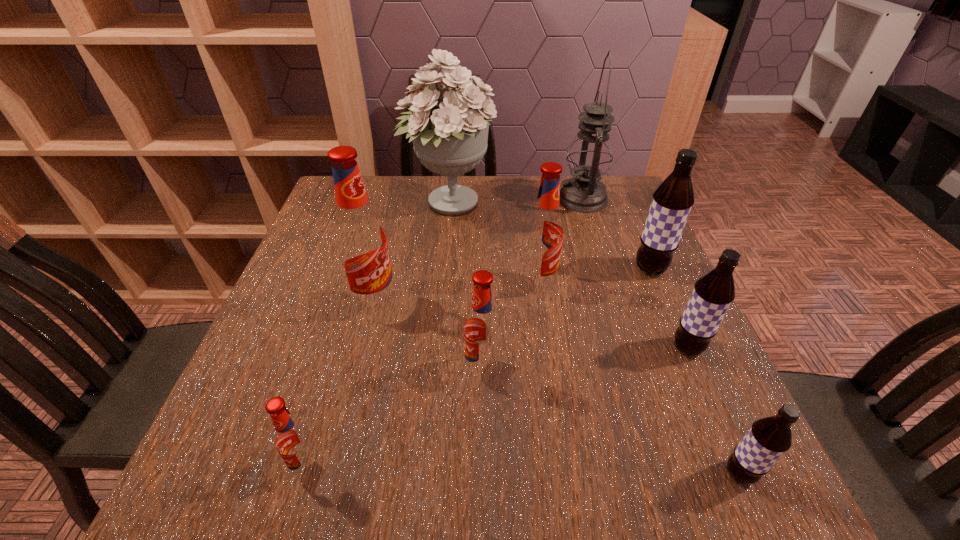
Identify the location of free space between the fourth root beer from right to left and the biggest brown root beer. (594, 276).

You are a GUI agent. You are given a task and a screenshot of the screen. Output one action in this format:
    pyautogui.click(x=<x>, y=<y>)
    Task: Click on the vacant region between the third farthest red root beer and the second farthest brown root beer
    
    Given the screenshot: What is the action you would take?
    pyautogui.click(x=585, y=359)

What are the coordinates of `vacant space that's between the third biggest red root beer and the biggest brown root beer` in the screenshot? It's located at (566, 319).

This screenshot has height=540, width=960. Find the location of `object that stands as the fourth closest to the oil lamp`. object that stands as the fourth closest to the oil lamp is located at coordinates (713, 293).

This screenshot has width=960, height=540. Find the location of `object that is the seventh closest to the fifth root beer from right to left`. object that is the seventh closest to the fifth root beer from right to left is located at coordinates (450, 139).

Find the location of a particular element. This screenshot has width=960, height=540. root beer that can be found as the closest to the rightmost red root beer is located at coordinates (482, 328).

In order to click on the closest root beer to the green bouquet in this screenshot , I will do `click(543, 236)`.

Locate an element on the screen. red root beer that is the nearest to the second nearest brown root beer is located at coordinates (543, 236).

Identify which red root beer is the third closest to the smallest brown root beer. Please provide its 2D coordinates. Your answer should be formatted as a tuple, i.e. [(x, y)], where the tuple contains the x and y coordinates of a point satisfying the conditions above.

[(294, 441)]

This screenshot has width=960, height=540. I want to click on brown root beer that is the third closest to the second red root beer from right to left, so (x=672, y=201).